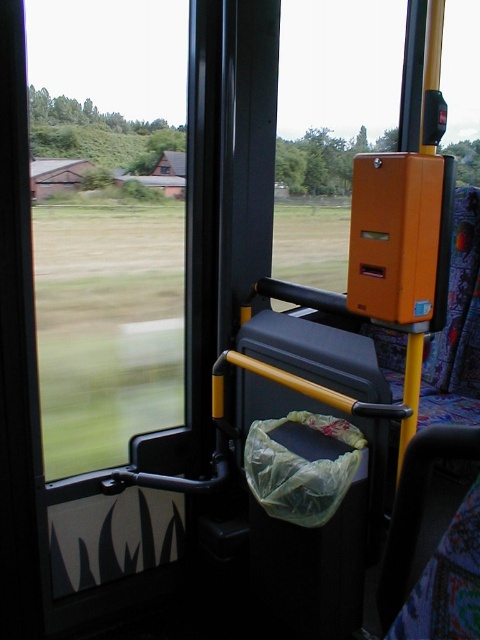
Which is more to the right, transparent glass window at left or orange plastic at upper center?

orange plastic at upper center

Does point (72, 35) come in front of point (311, 205)?

Yes, point (72, 35) is closer to viewer.

What are the coordinates of `transparent glass window at left` in the screenshot? It's located at (107, 221).